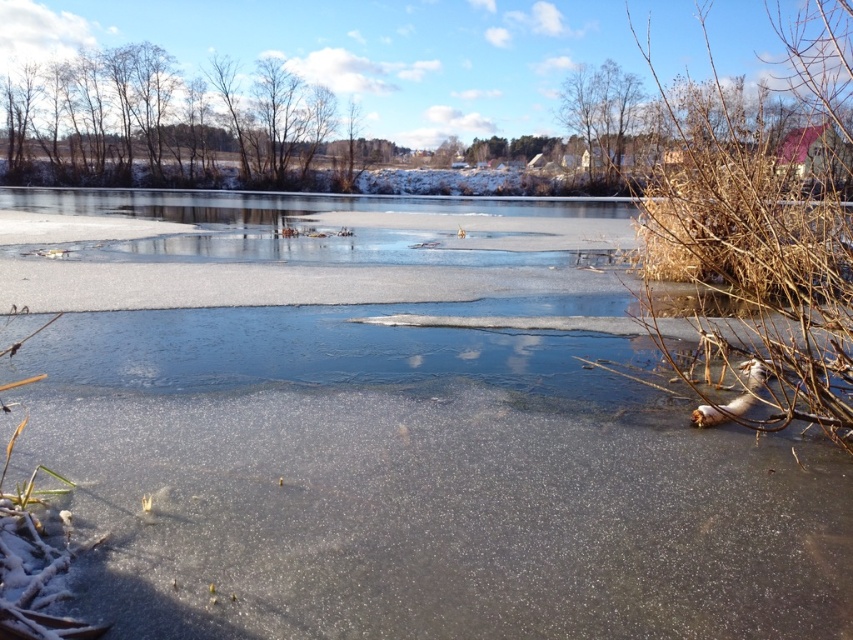
How distant is brown dry branches at right from bare branches at left?

brown dry branches at right is 31.63 meters from bare branches at left.

Is brown dry branches at right shorter than bare branches at left?

No.

The width and height of the screenshot is (853, 640). Describe the element at coordinates (758, 248) in the screenshot. I see `brown dry branches at right` at that location.

This screenshot has width=853, height=640. Find the location of `brown dry branches at right`. brown dry branches at right is located at coordinates (758, 248).